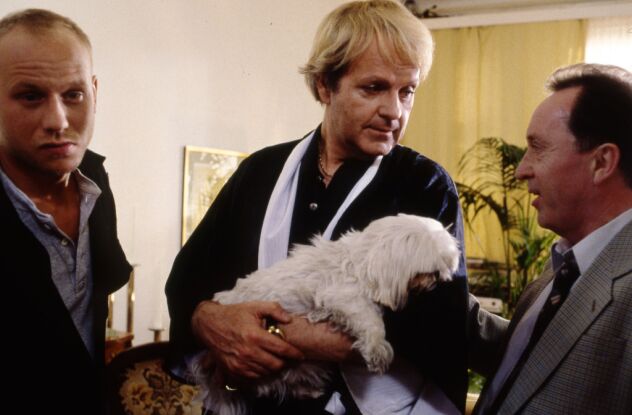
In order to click on curtains in this screenshot , I will do `click(509, 64)`.